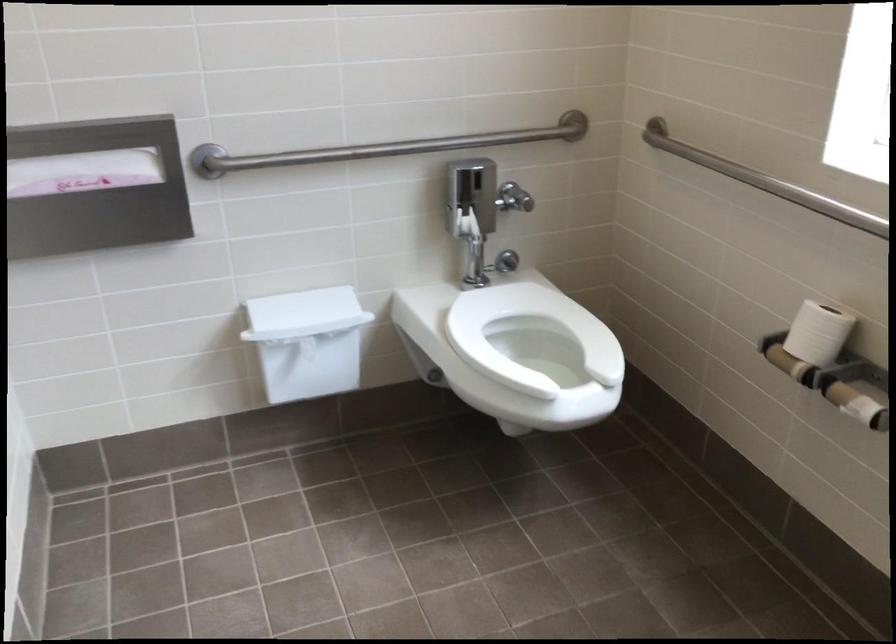
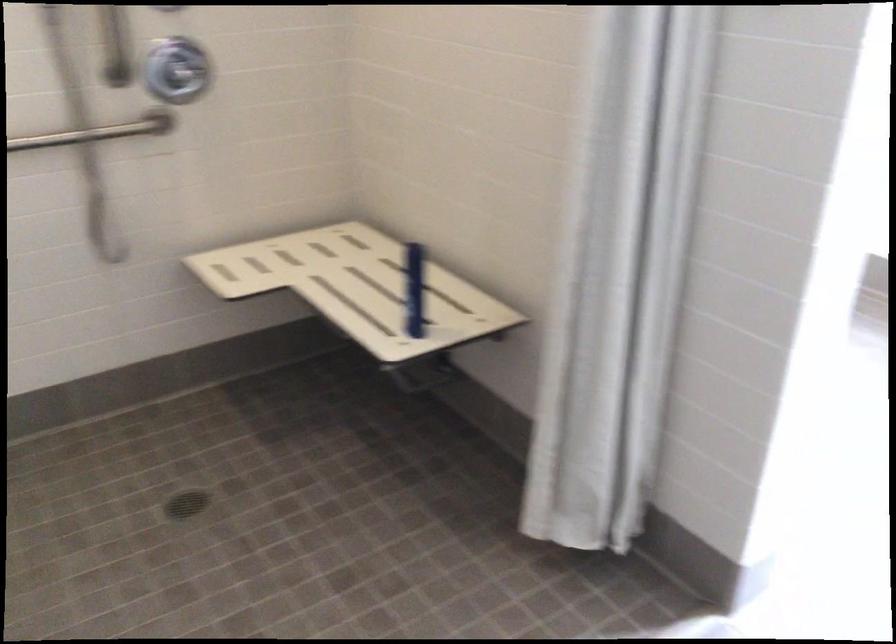
Question: I am providing you with two images of the same scene from different viewpoints. After the viewpoint changes to image2, which objects are now occluded?

Choices:
 (A) blue plastic bottle
 (B) chrome shower dial
 (C) white bin lid
 (D) white container handle

Answer: (C)